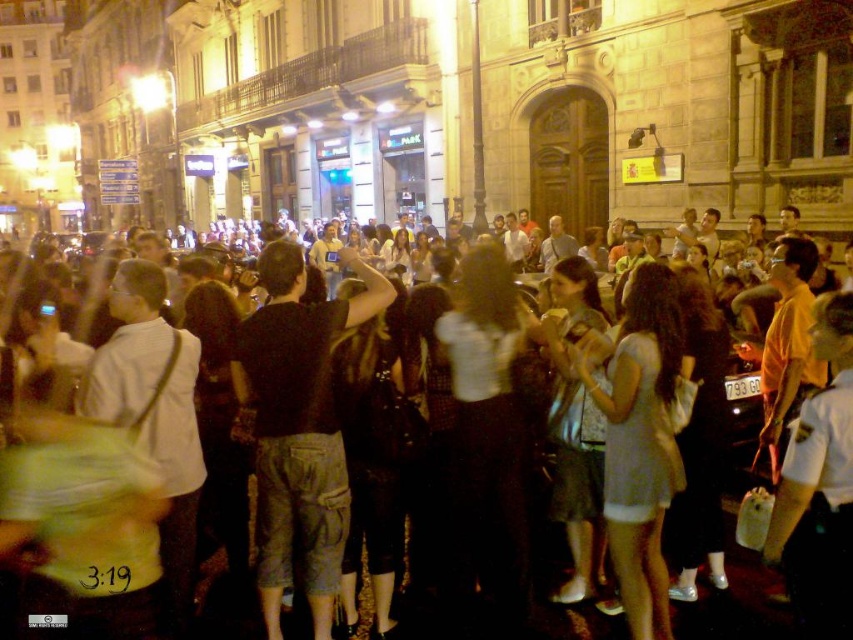
Which is in front, point (305, 452) or point (258, 627)?

Positioned in front is point (258, 627).

Does black cotton shirt at center have a greater width compared to dark clothing crowd at center?

In fact, black cotton shirt at center might be narrower than dark clothing crowd at center.

Where is `black cotton shirt at center`? The height and width of the screenshot is (640, 853). black cotton shirt at center is located at coordinates (299, 429).